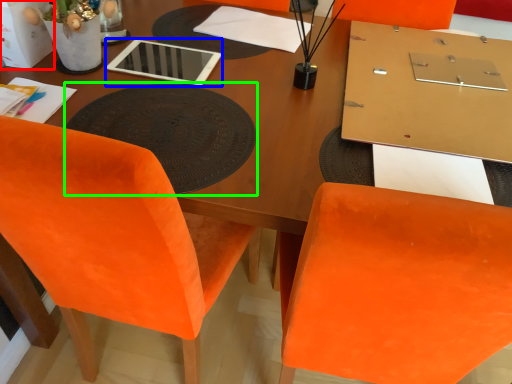
Question: Based on their relative distances, which object is nearer to box (highlighted by a red box)? Choose from tablet computer (highlighted by a blue box) and mat (highlighted by a green box).

Choices:
 (A) tablet computer
 (B) mat

Answer: (A)